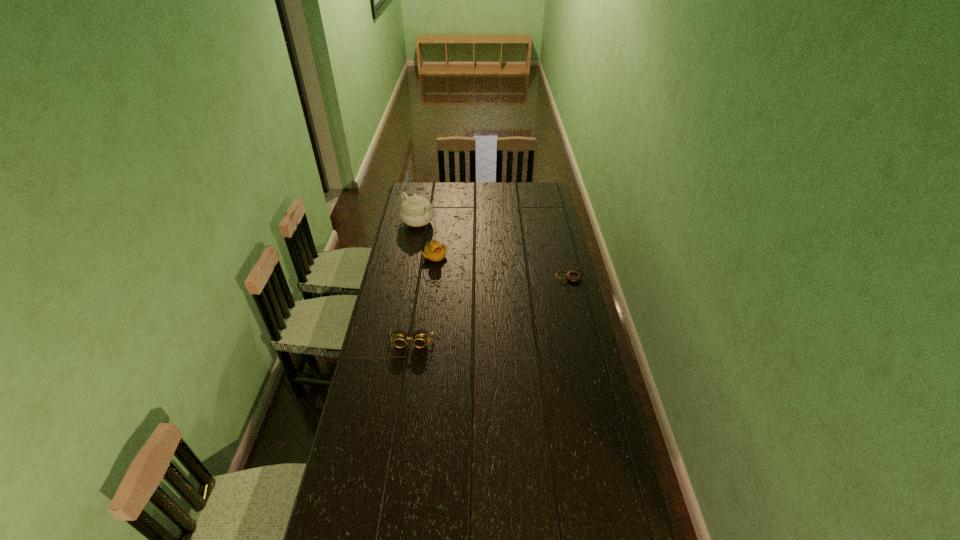
This screenshot has height=540, width=960. In order to click on vacant space on the desktop that is between the second shortest object and the rightmost object and is positioned on the front-facing side of the duckling in this screenshot , I will do `click(499, 304)`.

Locate an element on the screen. The width and height of the screenshot is (960, 540). vacant spot on the desktop that is between the nearest object and the shortest object and is positioned on the spout of the chinaware is located at coordinates (519, 295).